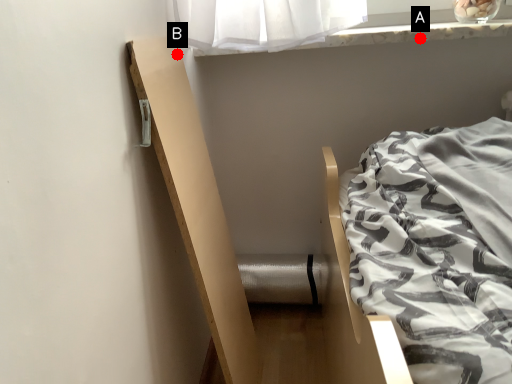
Question: Two points are circled on the image, labeled by A and B beside each circle. Which of the following is the closest to the observer?

Choices:
 (A) A is closer
 (B) B is closer

Answer: (B)